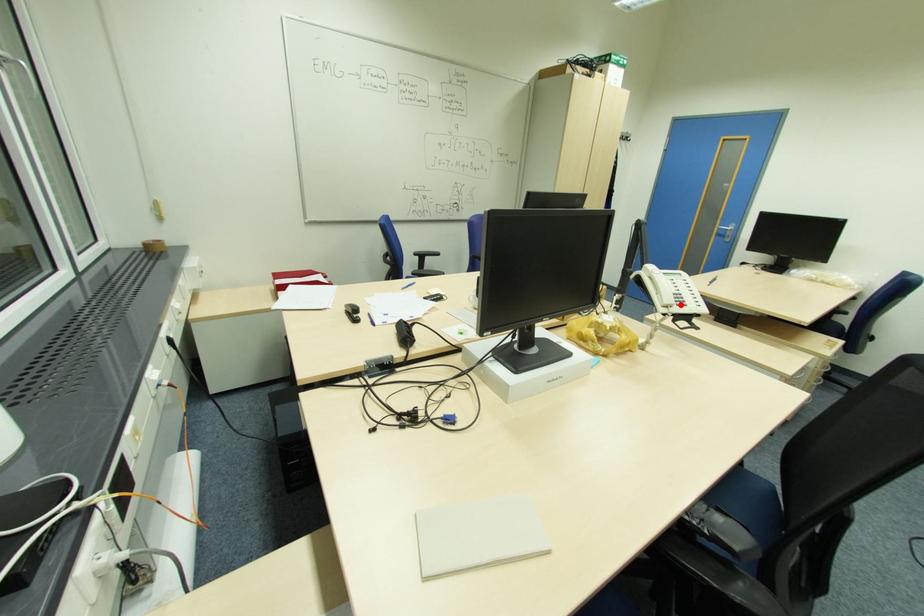
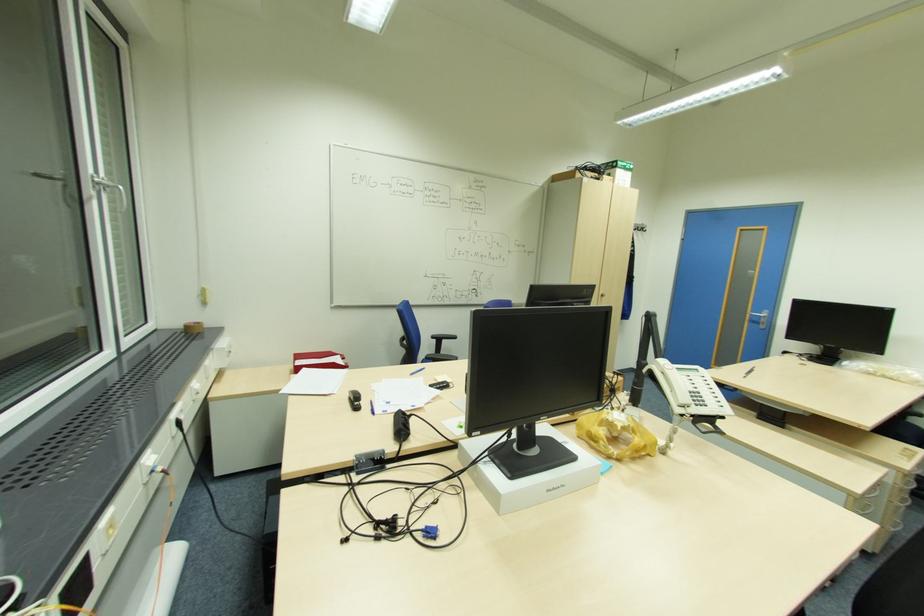
Where in the second image is the point corresponding to the highlighted location from the first image?

(699, 403)